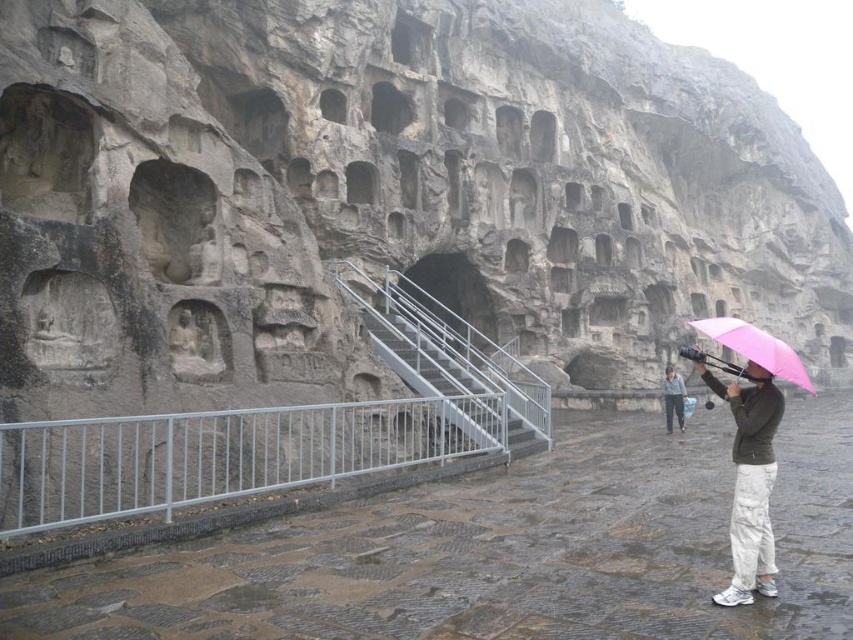
Question: Which of the following is the closest to the observer?

Choices:
 (A) pink matte umbrella at lower right
 (B) gray fabric jacket at center
 (C) white cotton pants at lower right

Answer: (C)

Question: Which object is the closest to the metal/stainless steel stairs at center?

Choices:
 (A) gray fabric jacket at center
 (B) white metal railing at lower center
 (C) pink matte umbrella at lower right
 (D) white cotton pants at lower right

Answer: (B)

Question: Can you confirm if white metal railing at lower center is smaller than gray fabric jacket at center?

Choices:
 (A) yes
 (B) no

Answer: (A)

Question: Can you confirm if pink matte umbrella at lower right is positioned below gray fabric jacket at center?

Choices:
 (A) yes
 (B) no

Answer: (B)

Question: Is white metal railing at lower center to the left of metal/stainless steel stairs at center from the viewer's perspective?

Choices:
 (A) yes
 (B) no

Answer: (A)

Question: Which point is closer to the camera?

Choices:
 (A) (796, 372)
 (B) (769, 401)
 (C) (680, 396)
 (D) (190, 460)

Answer: (B)